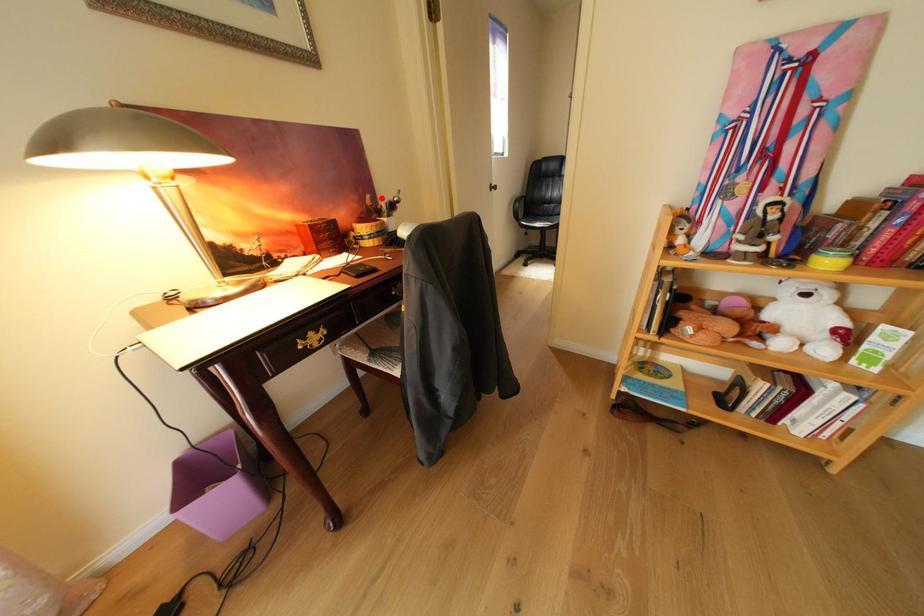
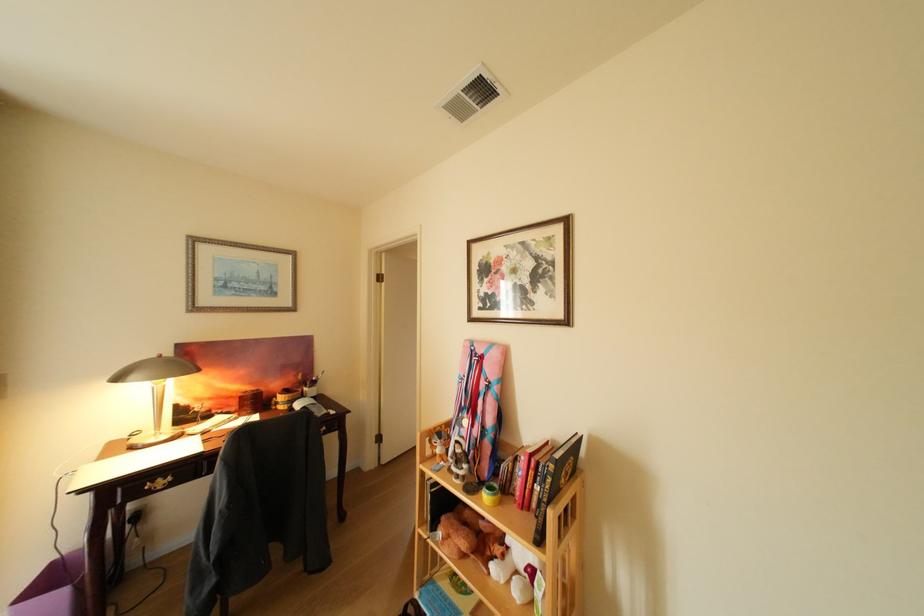
Question: I am providing you with two images of the same scene from different viewpoints. Image1 has a red point marked. In image2, the corresponding 3D location appears at what relative position? Reply with the corresponding letter.

Choices:
 (A) Closer
 (B) Farther

Answer: (B)